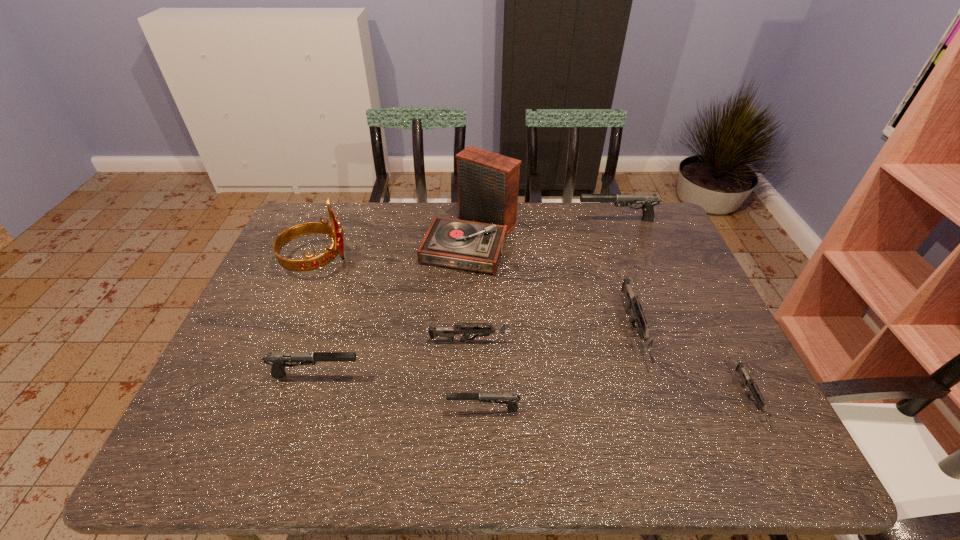
You are a GUI agent. You are given a task and a screenshot of the screen. Output one action in this format:
    pyautogui.click(x=<x>, y=<y>)
    Task: Click on the phonograph record
    Image resolution: width=960 pixels, height=540 pixels.
    Given the screenshot: What is the action you would take?
    pyautogui.click(x=488, y=183)

Where is `tiara`? Image resolution: width=960 pixels, height=540 pixels. tiara is located at coordinates (334, 231).

Identify the location of the biggest gray gun. This screenshot has height=540, width=960. (649, 201).

The image size is (960, 540). I want to click on the tallest gun, so [x=649, y=201].

Locate an element on the screen. The width and height of the screenshot is (960, 540). the second grey gun from left to right is located at coordinates (633, 304).

The width and height of the screenshot is (960, 540). I want to click on the second smallest gray gun, so click(x=277, y=360).

Find the location of a particular element. The width and height of the screenshot is (960, 540). the second nearest gray gun is located at coordinates (277, 360).

At what (x,y) coordinates should I click in order to perform the action: click on the leftmost grey gun. Please return your answer as a coordinate pair (x, y). The width and height of the screenshot is (960, 540). Looking at the image, I should click on (449, 332).

The image size is (960, 540). I want to click on the second gray gun from right to left, so click(510, 399).

Identify the location of the smallest gray gun. (510, 399).